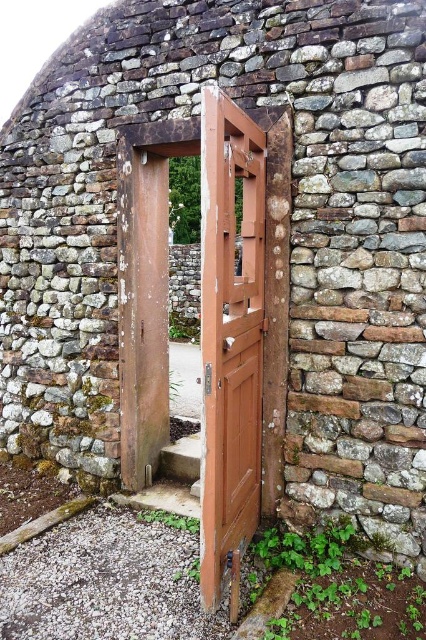
Does brown wooden door at center appear on the right side of wooden door at center?

Indeed, brown wooden door at center is positioned on the right side of wooden door at center.

Between point (242, 353) and point (201, 186), which one is positioned in front?

Point (242, 353) is in front.

You are a GUI agent. You are given a task and a screenshot of the screen. Output one action in this format:
    pyautogui.click(x=<x>, y=<y>)
    Task: Click on the brown wooden door at center
    This screenshot has height=640, width=426.
    Given the screenshot: What is the action you would take?
    pyautogui.click(x=207, y=310)